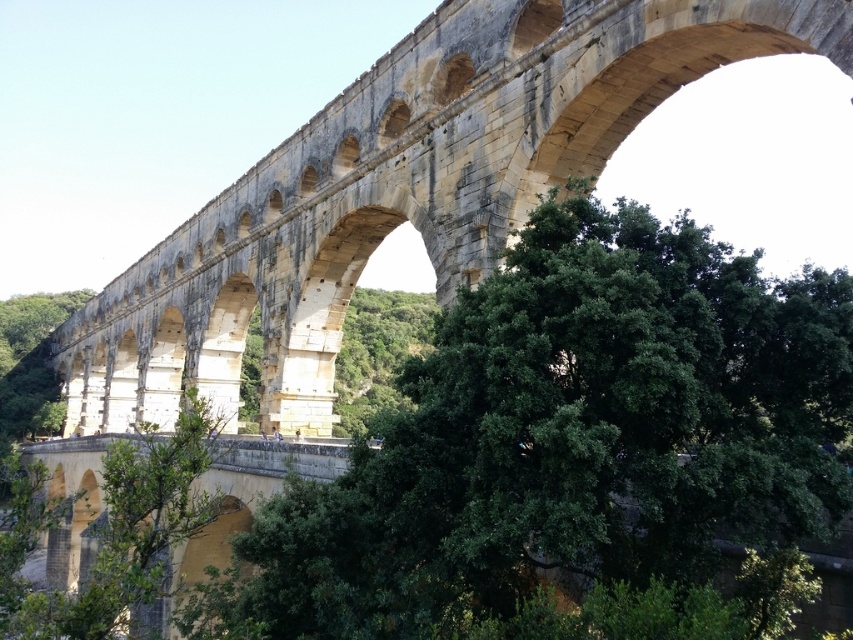
Between green leafy tree at center and stone arch bridge at center, which one appears on the left side from the viewer's perspective?

From the viewer's perspective, stone arch bridge at center appears more on the left side.

Does green leafy tree at center have a greater height compared to stone arch bridge at center?

No, green leafy tree at center is not taller than stone arch bridge at center.

Based on the photo, who is more forward, (642, 426) or (477, 60)?

Point (642, 426)

Identify the location of green leafy tree at center. The width and height of the screenshot is (853, 640). (573, 435).